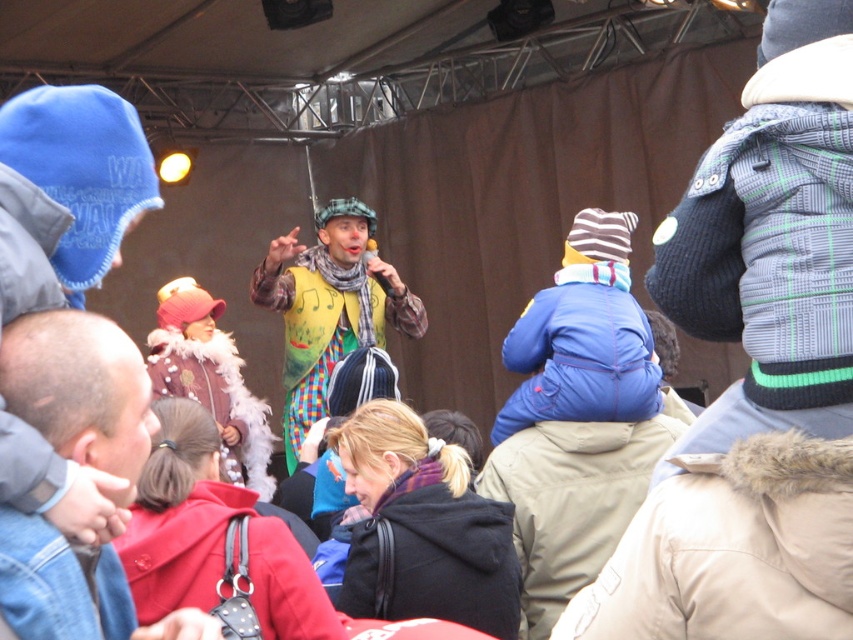
You are standing in the crowd at this event and want to take a photo of both the black fleece jacket at lower center and the velvet fur coat at center. Which one will appear larger in your photo?

The black fleece jacket at lower center will appear larger in the photo because it is closer to the viewer than the velvet fur coat at center.

You are at the event and want to take a photo of the two points mentioned. Which point, point (396,506) or point (283,374), will appear larger in your photo?

Point (396,506) is closer to the viewer than point (283,374), so it will appear larger in the photo.

Consider the image. You are attending a festival and see the black fleece jacket at lower center and the yellow fabric clown at center. Which object is positioned lower in the image?

The black fleece jacket at lower center is positioned lower than the yellow fabric clown at center.